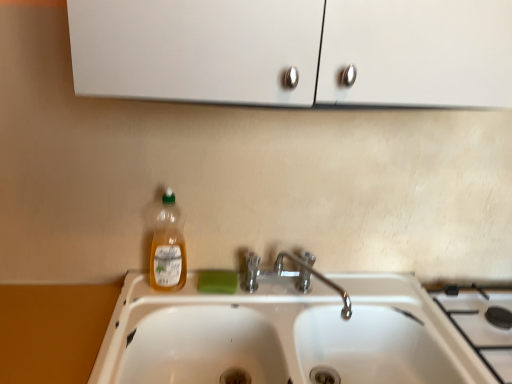
At what (x,y) coordinates should I click in order to perform the action: click on vacant location below chrome metallic faucet at sink center (from a real-world perspective). Please return your answer as a coordinate pair (x, y). The width and height of the screenshot is (512, 384). Looking at the image, I should click on (294, 301).